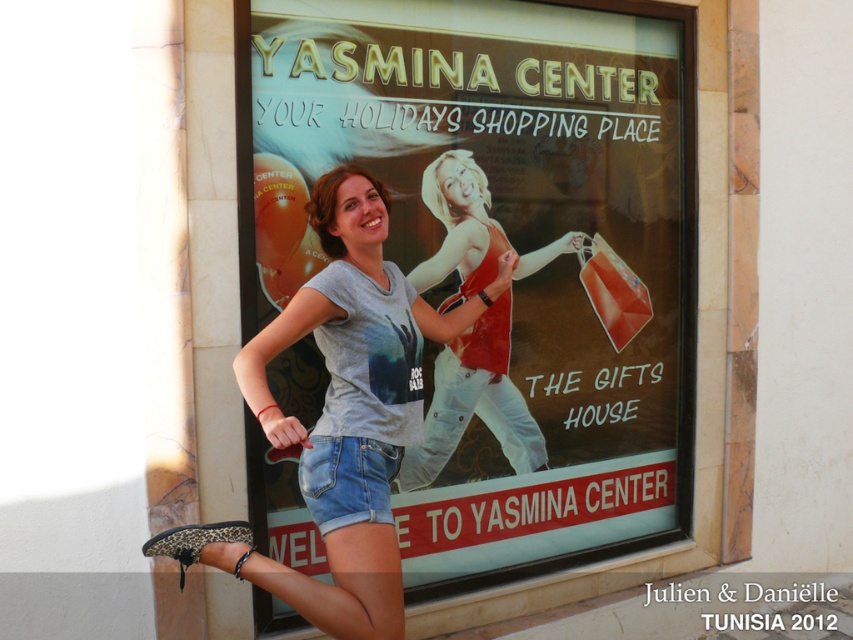
Question: Which object appears closest to the camera in this image?

Choices:
 (A) gray cotton t-shirt at center
 (B) matte red tank top at center

Answer: (A)

Question: Is matte plastic signboard at center to the left of matte red tank top at center from the viewer's perspective?

Choices:
 (A) yes
 (B) no

Answer: (B)

Question: Which point is farther to the camera?

Choices:
 (A) matte plastic signboard at center
 (B) gray cotton t-shirt at center
 (C) matte red tank top at center

Answer: (C)

Question: Which point is farther from the camera taking this photo?

Choices:
 (A) (421, 420)
 (B) (567, 250)
 (C) (312, 518)

Answer: (B)

Question: Can you confirm if matte plastic signboard at center is wider than denim shorts at lower center?

Choices:
 (A) yes
 (B) no

Answer: (A)

Question: Is matte plastic signboard at center below matte red tank top at center?

Choices:
 (A) no
 (B) yes

Answer: (A)